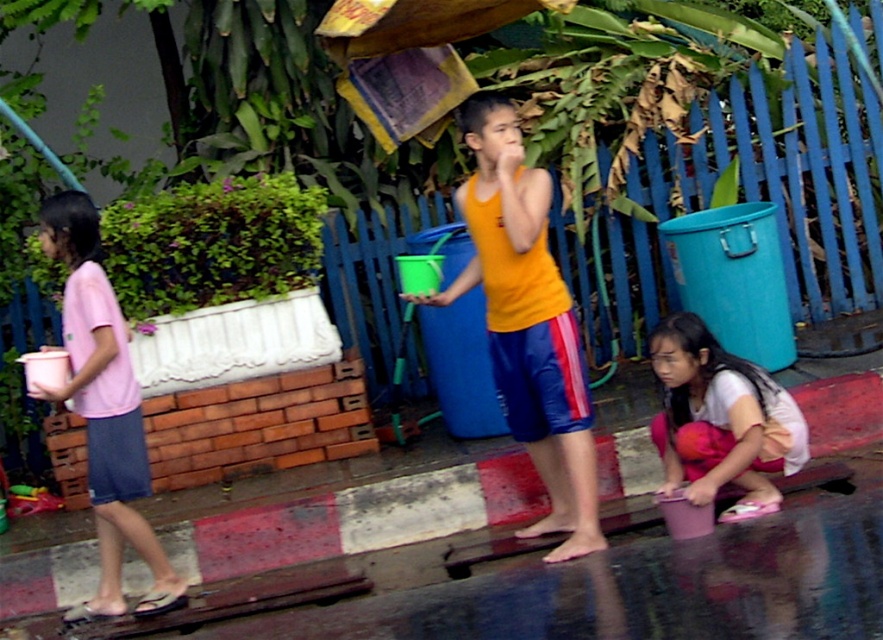
Does orange matte tank top at center appear on the right side of pink fabric skirt at lower right?

In fact, orange matte tank top at center is to the left of pink fabric skirt at lower right.

Who is shorter, orange matte tank top at center or pink fabric skirt at lower right?

pink fabric skirt at lower right

Locate an element on the screen. The width and height of the screenshot is (883, 640). orange matte tank top at center is located at coordinates (527, 321).

At what (x,y) coordinates should I click in order to perform the action: click on orange matte tank top at center. Please return your answer as a coordinate pair (x, y). This screenshot has height=640, width=883. Looking at the image, I should click on (527, 321).

Which is in front, point (74, 362) or point (672, 476)?

Point (74, 362) is in front.

How much distance is there between pink matte bucket at left and pink fabric skirt at lower right?

They are 2.56 meters apart.

At what (x,y) coordinates should I click in order to perform the action: click on pink matte bucket at left. Please return your answer as a coordinate pair (x, y). Image resolution: width=883 pixels, height=640 pixels. Looking at the image, I should click on (x=104, y=410).

Measure the distance between orange matte tank top at center and pink matte bucket at left.

orange matte tank top at center is 5.61 feet from pink matte bucket at left.

Is orange matte tank top at center smaller than pink matte bucket at left?

Incorrect, orange matte tank top at center is not smaller in size than pink matte bucket at left.

Find the location of a particular element. orange matte tank top at center is located at coordinates (527, 321).